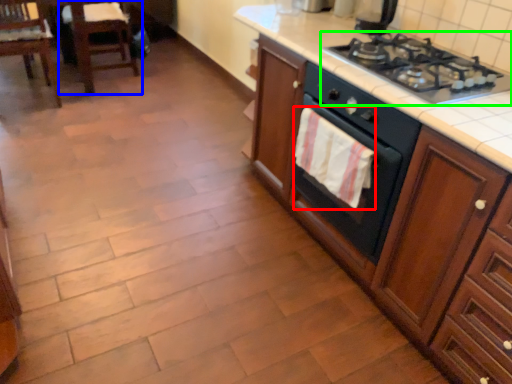
Question: Estimate the real-world distances between objects in this image. Which object is farther from hand towel (highlighted by a red box), chair (highlighted by a blue box) or gas stove (highlighted by a green box)?

Choices:
 (A) chair
 (B) gas stove

Answer: (A)